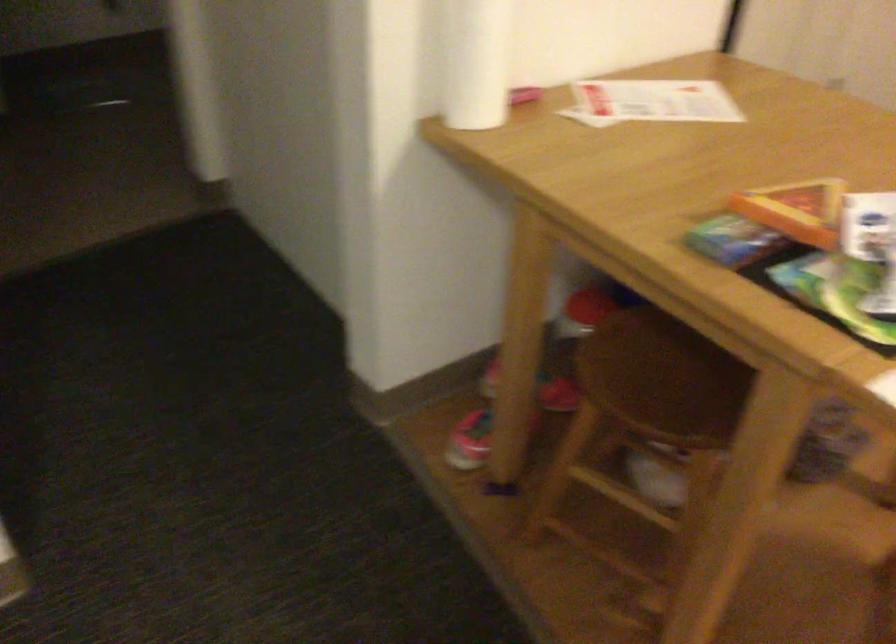
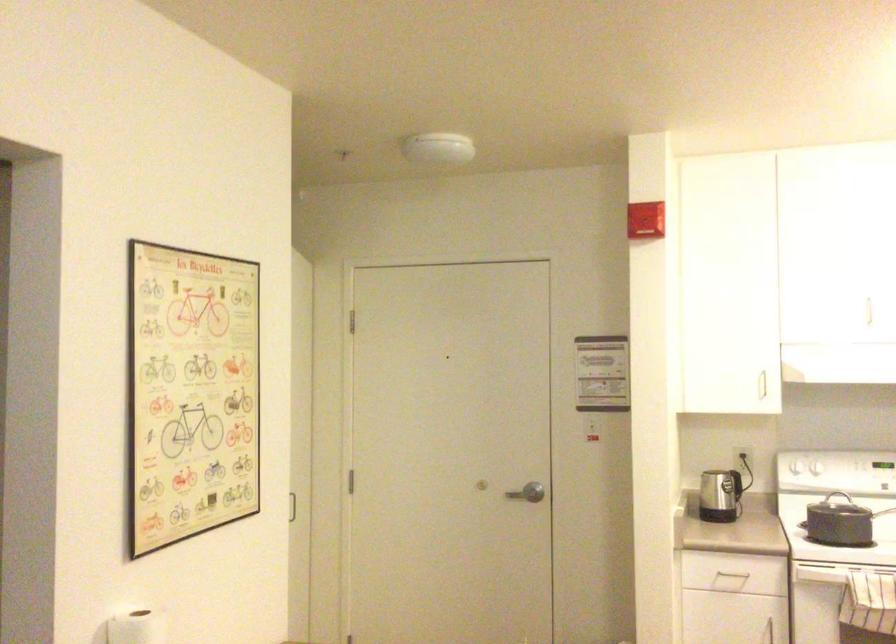
How did the camera likely rotate?

The camera rotated toward right-up.